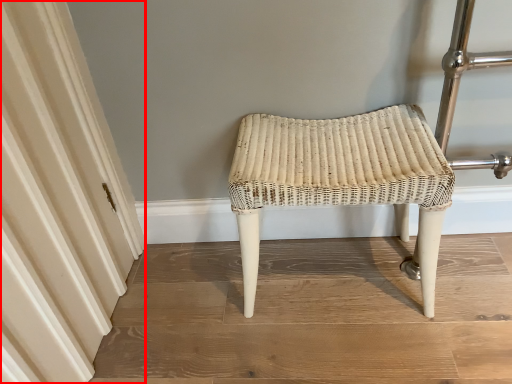
Question: From the image's perspective, where is curtain (annotated by the red box) located in relation to stool in the image?

Choices:
 (A) below
 (B) above

Answer: (B)